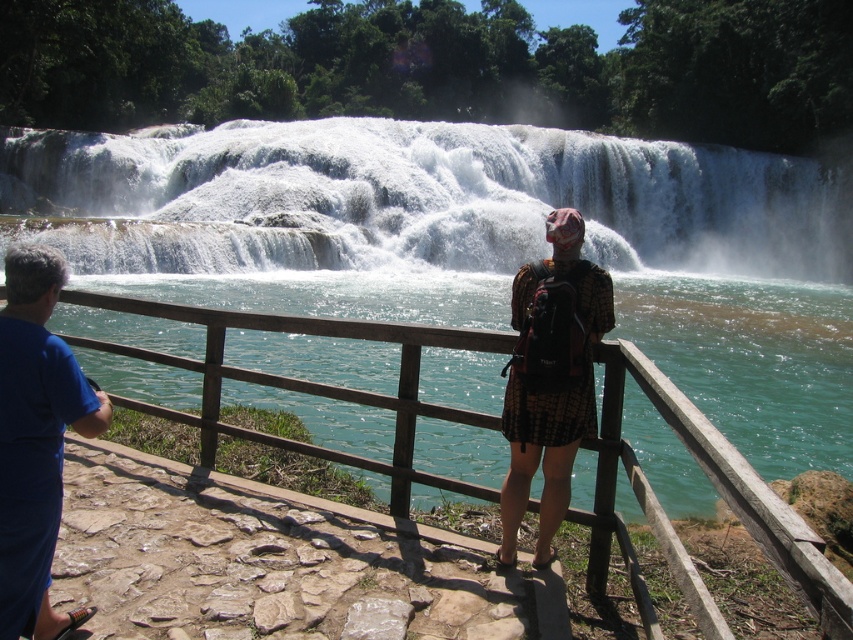
Is blue fabric shirt at lower left wider than plaid fabric dress at center?

Correct, the width of blue fabric shirt at lower left exceeds that of plaid fabric dress at center.

This screenshot has width=853, height=640. What do you see at coordinates (35, 440) in the screenshot?
I see `blue fabric shirt at lower left` at bounding box center [35, 440].

Between point (62, 385) and point (537, 332), which one is positioned in front?

Point (62, 385)

At what (x,y) coordinates should I click in order to perform the action: click on blue fabric shirt at lower left. Please return your answer as a coordinate pair (x, y). The width and height of the screenshot is (853, 640). Looking at the image, I should click on (35, 440).

Does white frothy water at center have a greater height compared to brown wooden rail at center?

Indeed, white frothy water at center has a greater height compared to brown wooden rail at center.

Does white frothy water at center appear on the left side of brown wooden rail at center?

No, white frothy water at center is not to the left of brown wooden rail at center.

Does point (637, 264) lie behind point (256, 323)?

That is True.

Locate an element on the screen. white frothy water at center is located at coordinates (431, 196).

Can you confirm if brown wooden rail at center is wider than blue fabric shirt at lower left?

Yes, brown wooden rail at center is wider than blue fabric shirt at lower left.

Who is higher up, brown wooden rail at center or blue fabric shirt at lower left?

brown wooden rail at center

What do you see at coordinates (306, 381) in the screenshot?
I see `brown wooden rail at center` at bounding box center [306, 381].

Where is `brown wooden rail at center`? Image resolution: width=853 pixels, height=640 pixels. brown wooden rail at center is located at coordinates (306, 381).